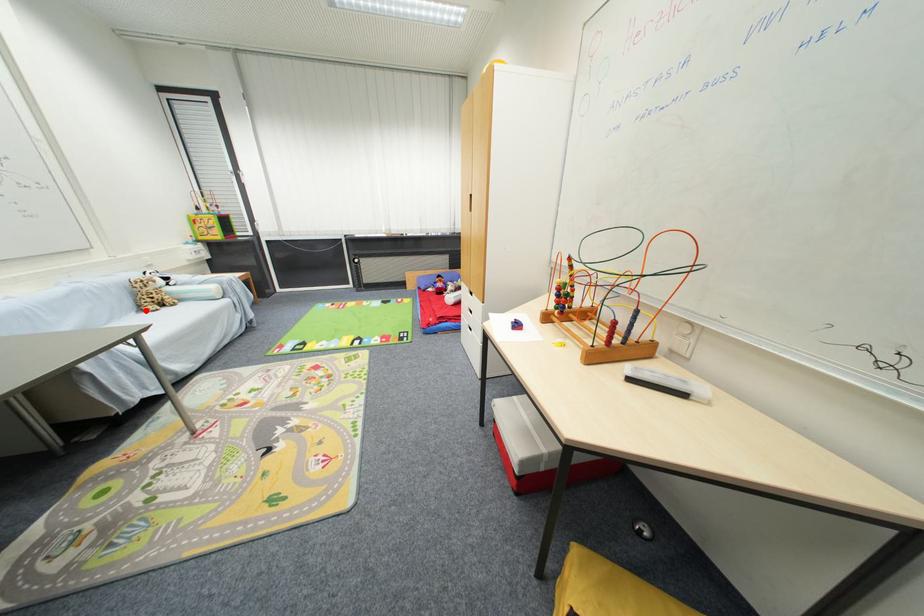
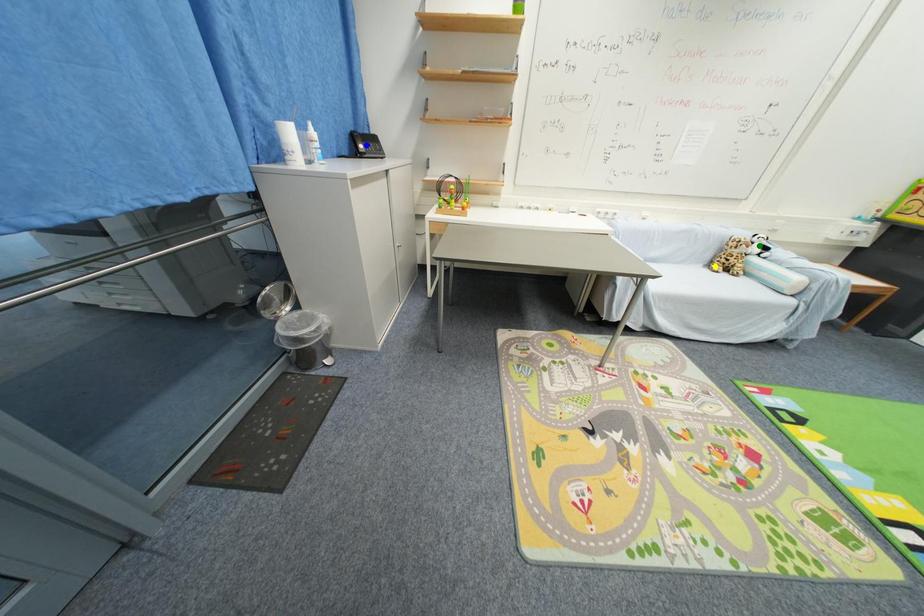
Question: I am providing you with two images of the same scene from different viewpoints. A red point is marked on the first image. You are given multiple points on the second image. Which spot in image 2 lines up with the point in image 1?

Choices:
 (A) blue point
 (B) yellow point
 (C) green point

Answer: (B)